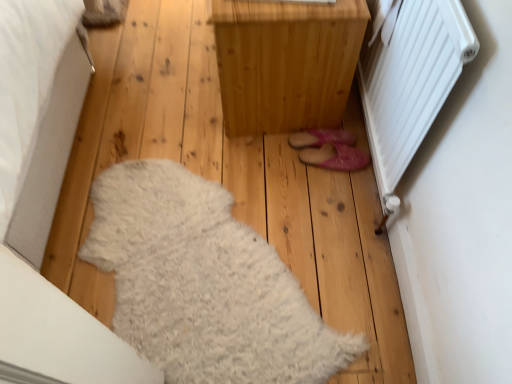
Question: Is natural wood cabinet at center at the right side of white fluffy rug at lower left?

Choices:
 (A) no
 (B) yes

Answer: (B)

Question: Is natural wood cabinet at center positioned with its back to white fluffy rug at lower left?

Choices:
 (A) yes
 (B) no

Answer: (B)

Question: From the image's perspective, is natural wood cabinet at center over white fluffy rug at lower left?

Choices:
 (A) yes
 (B) no

Answer: (A)

Question: Considering the relative sizes of natural wood cabinet at center and white fluffy rug at lower left in the image provided, is natural wood cabinet at center smaller than white fluffy rug at lower left?

Choices:
 (A) yes
 (B) no

Answer: (B)

Question: Is natural wood cabinet at center outside white fluffy rug at lower left?

Choices:
 (A) yes
 (B) no

Answer: (A)

Question: Does natural wood cabinet at center have a lesser height compared to white fluffy rug at lower left?

Choices:
 (A) no
 (B) yes

Answer: (A)

Question: Considering the relative sizes of pink fuzzy slippers at center and natural wood cabinet at center in the image provided, is pink fuzzy slippers at center bigger than natural wood cabinet at center?

Choices:
 (A) no
 (B) yes

Answer: (A)

Question: Can you confirm if pink fuzzy slippers at center is wider than natural wood cabinet at center?

Choices:
 (A) no
 (B) yes

Answer: (A)

Question: From a real-world perspective, is pink fuzzy slippers at center located higher than natural wood cabinet at center?

Choices:
 (A) no
 (B) yes

Answer: (A)

Question: Could you tell me if pink fuzzy slippers at center is facing natural wood cabinet at center?

Choices:
 (A) no
 (B) yes

Answer: (A)

Question: Can you confirm if pink fuzzy slippers at center is positioned to the left of natural wood cabinet at center?

Choices:
 (A) no
 (B) yes

Answer: (A)

Question: Is pink fuzzy slippers at center in front of natural wood cabinet at center?

Choices:
 (A) no
 (B) yes

Answer: (A)

Question: From the image's perspective, does white fluffy rug at lower left appear lower than natural wood cabinet at center?

Choices:
 (A) yes
 (B) no

Answer: (A)